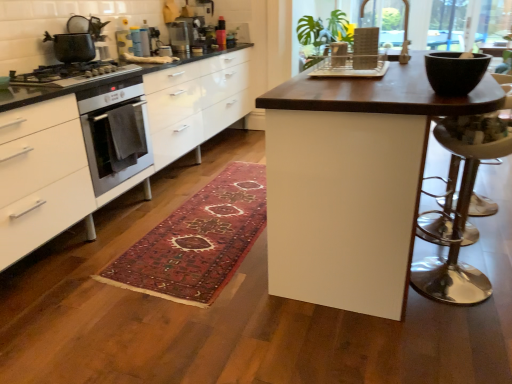
Question: Can you confirm if polished silver bar stool at right is positioned to the left of translucent plastic blender at upper center, placed as the 2th appliance when sorted from right to left?

Choices:
 (A) yes
 (B) no

Answer: (B)

Question: From the image's perspective, does polished silver bar stool at right appear lower than translucent plastic blender at upper center, the second appliance positioned from the left?

Choices:
 (A) yes
 (B) no

Answer: (A)

Question: Does polished silver bar stool at right turn towards translucent plastic blender at upper center, which ranks as the 3th appliance in bottom-to-top order?

Choices:
 (A) no
 (B) yes

Answer: (A)

Question: From a real-world perspective, is polished silver bar stool at right physically above translucent plastic blender at upper center, which ranks as the 3th appliance in bottom-to-top order?

Choices:
 (A) no
 (B) yes

Answer: (A)

Question: Considering the relative positions of polished silver bar stool at right and translucent plastic blender at upper center, the 1th appliance viewed from the top, in the image provided, is polished silver bar stool at right behind translucent plastic blender at upper center, the 1th appliance viewed from the top,?

Choices:
 (A) no
 (B) yes

Answer: (A)

Question: Based on their sizes in the image, would you say white glossy cabinets at left is bigger or smaller than dark wood table at center?

Choices:
 (A) big
 (B) small

Answer: (A)

Question: From the image's perspective, is white glossy cabinets at left above or below dark wood table at center?

Choices:
 (A) above
 (B) below

Answer: (A)

Question: Relative to dark wood table at center, is white glossy cabinets at left in front or behind?

Choices:
 (A) front
 (B) behind

Answer: (B)

Question: Looking at their shapes, would you say white glossy cabinets at left is wider or thinner than dark wood table at center?

Choices:
 (A) wide
 (B) thin

Answer: (B)

Question: Considering the positions of point (170, 24) and point (364, 41), is point (170, 24) closer or farther from the camera than point (364, 41)?

Choices:
 (A) farther
 (B) closer

Answer: (A)

Question: From a real-world perspective, relative to matte plastic dish rack at center, arranged as the first appliance when viewed from the right, is translucent plastic blender at upper center, the 3th appliance positioned from the front, vertically above or below?

Choices:
 (A) below
 (B) above

Answer: (A)

Question: Do you think translucent plastic blender at upper center, arranged as the first appliance when viewed from the back, is within matte plastic dish rack at center, which is counted as the 3th appliance, starting from the back, or outside of it?

Choices:
 (A) outside
 (B) inside

Answer: (A)

Question: Looking at their shapes, would you say translucent plastic blender at upper center, the 1th appliance viewed from the top, is wider or thinner than matte plastic dish rack at center, arranged as the first appliance when viewed from the right?

Choices:
 (A) thin
 (B) wide

Answer: (B)

Question: Considering the positions of polished silver bar stool at right and metallic silver toaster at upper center, the second appliance positioned from the top, in the image, is polished silver bar stool at right taller or shorter than metallic silver toaster at upper center, the second appliance positioned from the top,?

Choices:
 (A) short
 (B) tall

Answer: (B)

Question: Is polished silver bar stool at right wider or thinner than metallic silver toaster at upper center, marked as the first appliance in a left-to-right arrangement?

Choices:
 (A) thin
 (B) wide

Answer: (B)